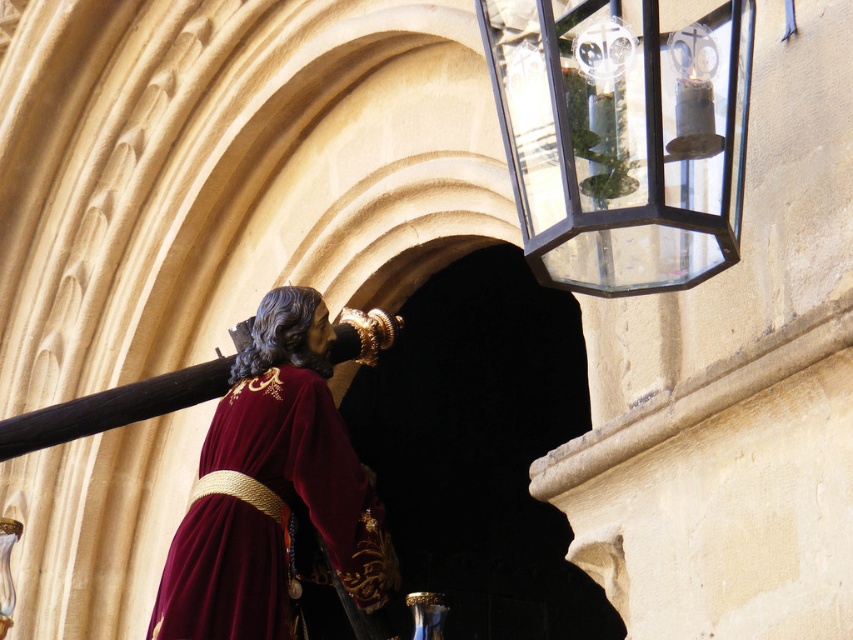
Question: Which of the following is the farthest from the observer?

Choices:
 (A) (238, 426)
 (B) (509, 19)

Answer: (A)

Question: Can you confirm if clear glass lantern at upper right is positioned to the left of velvet maroon robe at center?

Choices:
 (A) no
 (B) yes

Answer: (A)

Question: Does clear glass lantern at upper right appear over velvet maroon robe at center?

Choices:
 (A) yes
 (B) no

Answer: (A)

Question: Is clear glass lantern at upper right to the left of velvet maroon robe at center from the viewer's perspective?

Choices:
 (A) yes
 (B) no

Answer: (B)

Question: Among these points, which one is nearest to the camera?

Choices:
 (A) (584, 83)
 (B) (219, 611)

Answer: (A)